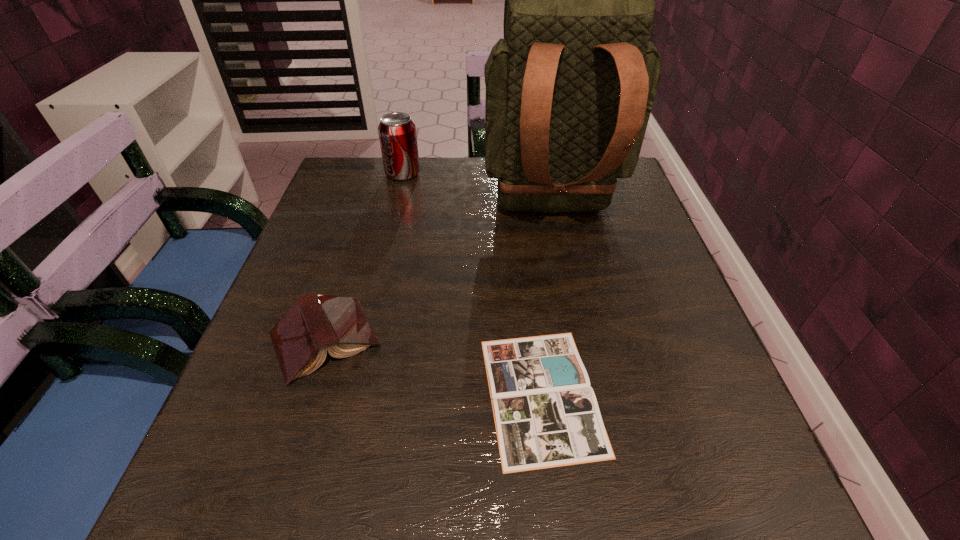
Identify the location of vacant space at the left edge of the desktop. This screenshot has height=540, width=960. (332, 252).

You are a GUI agent. You are given a task and a screenshot of the screen. Output one action in this format:
    pyautogui.click(x=<x>, y=<y>)
    Task: Click on the vacant space at the right edge of the desktop
    This screenshot has height=540, width=960.
    Given the screenshot: What is the action you would take?
    click(x=584, y=221)

Image resolution: width=960 pixels, height=540 pixels. In the image, there is a desktop. In order to click on vacant area at the far left corner in this screenshot , I will do `click(363, 179)`.

In the image, there is a desktop. Identify the location of free space at the near left corner. (187, 498).

In the image, there is a desktop. Where is `vacant space at the far right corner`? Image resolution: width=960 pixels, height=540 pixels. vacant space at the far right corner is located at coordinates (618, 190).

You are a GUI agent. You are given a task and a screenshot of the screen. Output one action in this format:
    pyautogui.click(x=<x>, y=<y>)
    Task: Click on the blank region between the shortest object and the third shortest object
    This screenshot has width=960, height=540.
    Given the screenshot: What is the action you would take?
    pyautogui.click(x=472, y=284)

Find the location of a particular element. This screenshot has height=540, width=960. free area in between the soda can and the taller book is located at coordinates (364, 256).

The width and height of the screenshot is (960, 540). I want to click on vacant space that is in between the soda can and the shortest object, so click(472, 284).

Where is `vacant area that lies between the second tallest object and the second shortest object`? This screenshot has width=960, height=540. vacant area that lies between the second tallest object and the second shortest object is located at coordinates (364, 256).

This screenshot has width=960, height=540. I want to click on vacant point located between the soda can and the third tallest object, so click(x=364, y=256).